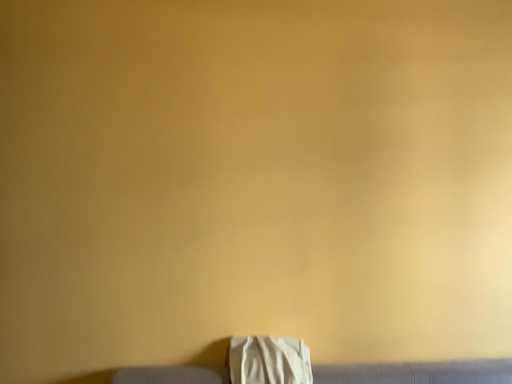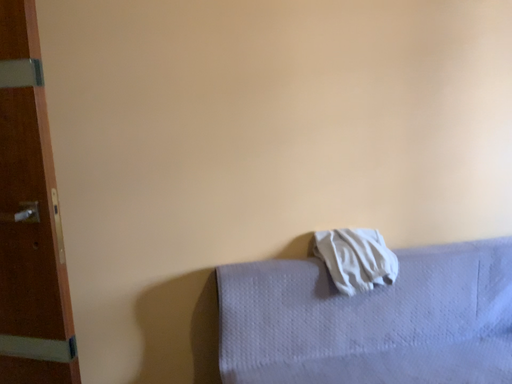
Question: Which way did the camera rotate in the video?

Choices:
 (A) rotated right
 (B) rotated left

Answer: (A)